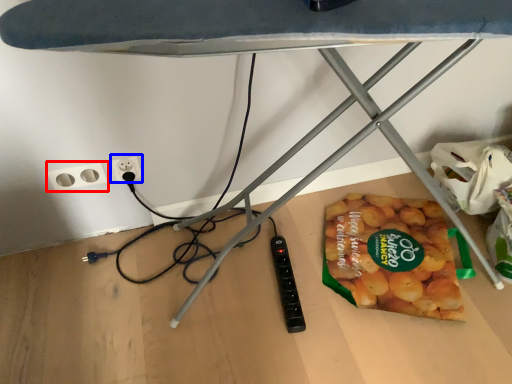
Question: Which object appears closest to the camera in this image, socket (highlighted by a red box) or electric outlet (highlighted by a blue box)?

Choices:
 (A) socket
 (B) electric outlet

Answer: (A)